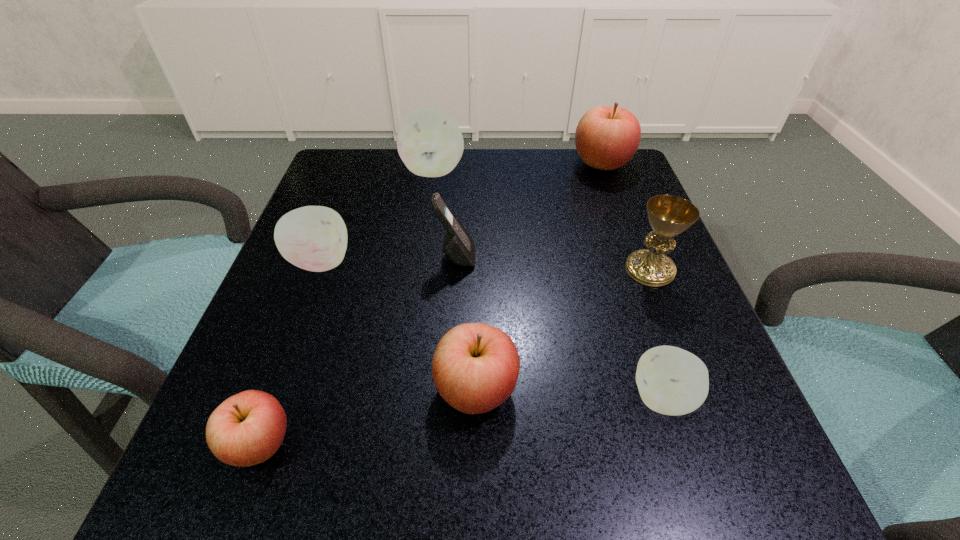
You are a GUI agent. You are given a task and a screenshot of the screen. Output one action in this format:
    pyautogui.click(x=<x>, y=<y>)
    Task: Click on the vacant point that satisfies the following two spatial constraints: 1. on the front-facing side of the cellular telephone; 2. on the back side of the chalice
    The height and width of the screenshot is (540, 960).
    Given the screenshot: What is the action you would take?
    pyautogui.click(x=455, y=269)